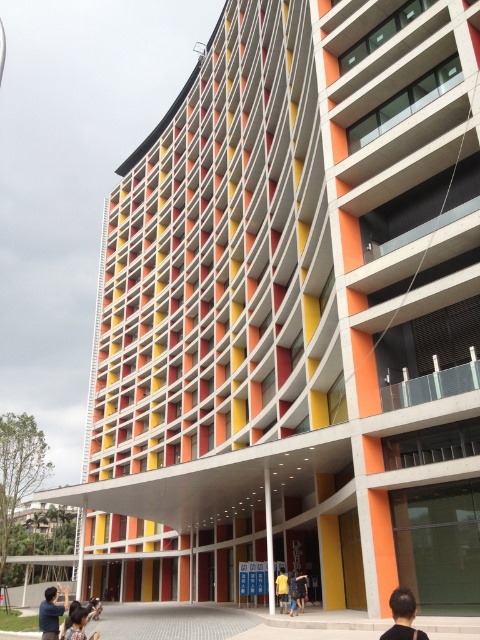
Can you confirm if black hair at lower center is wider than yellow matte shirt at center?

Incorrect, black hair at lower center's width does not surpass yellow matte shirt at center's.

Does black hair at lower center lie behind yellow matte shirt at center?

No.

Locate an element on the screen. black hair at lower center is located at coordinates (403, 616).

You are a GUI agent. You are given a task and a screenshot of the screen. Output one action in this format:
    pyautogui.click(x=<x>, y=<y>)
    Task: Click on the black hair at lower center
    
    Given the screenshot: What is the action you would take?
    pyautogui.click(x=403, y=616)

Can you confirm if dark brown hair at lower left is thinner than yellow casual shirt at center?

Yes.

Who is positioned more to the right, dark brown hair at lower left or yellow casual shirt at center?

yellow casual shirt at center is more to the right.

Locate an element on the screen. The height and width of the screenshot is (640, 480). dark brown hair at lower left is located at coordinates (x=78, y=625).

Between black hair at lower center and dark blue shirt at lower left, which one has more height?

Standing taller between the two is dark blue shirt at lower left.

Is black hair at lower center below dark blue shirt at lower left?

Incorrect, black hair at lower center is not positioned below dark blue shirt at lower left.

This screenshot has width=480, height=640. In order to click on black hair at lower center in this screenshot , I will do tap(403, 616).